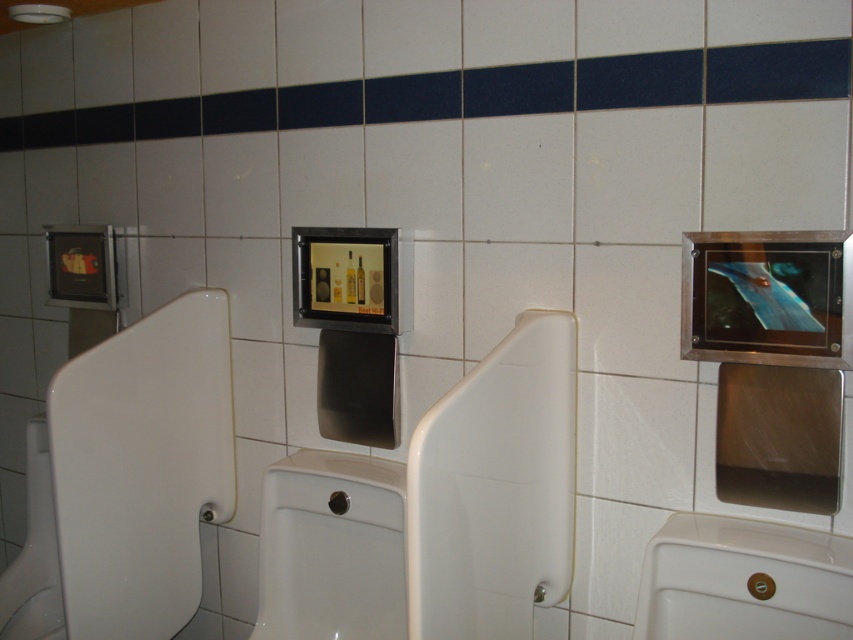
Question: Considering the relative positions of white glossy urinal at left and white glossy toilet bowl at center in the image provided, where is white glossy urinal at left located with respect to white glossy toilet bowl at center?

Choices:
 (A) right
 (B) left

Answer: (B)

Question: Among these objects, which one is nearest to the camera?

Choices:
 (A) white glossy toilet bowl at center
 (B) white glossy urinal at lower right
 (C) white glossy urinal at center
 (D) white glossy urinal at left

Answer: (C)

Question: Considering the relative positions of white glossy urinal at left and white glossy toilet bowl at center in the image provided, where is white glossy urinal at left located with respect to white glossy toilet bowl at center?

Choices:
 (A) left
 (B) right

Answer: (A)

Question: Which of the following is the farthest from the observer?

Choices:
 (A) (154, 588)
 (B) (524, 486)

Answer: (A)

Question: Which object appears farthest from the camera in this image?

Choices:
 (A) white glossy urinal at center
 (B) white glossy toilet bowl at center
 (C) white glossy urinal at lower right

Answer: (B)

Question: Is white glossy urinal at center below white glossy toilet bowl at center?

Choices:
 (A) yes
 (B) no

Answer: (B)